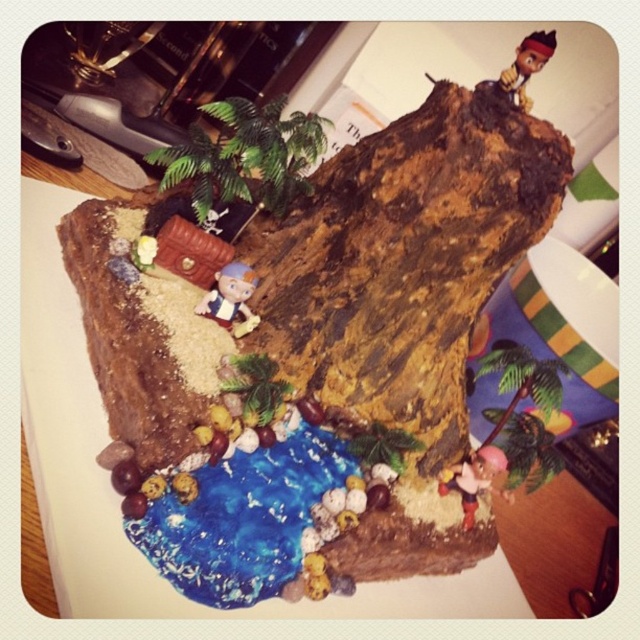
Question: Which point appears farthest from the camera in this image?

Choices:
 (A) (509, 92)
 (B) (221, 534)

Answer: (A)

Question: Among these points, which one is nearest to the camera?

Choices:
 (A) (541, 42)
 (B) (182, 557)

Answer: (B)

Question: Does brown sugar pirate ship at center have a greater width compared to smooth brown figurine at upper right?

Choices:
 (A) yes
 (B) no

Answer: (A)

Question: Does brown sugar pirate ship at center have a greater width compared to smooth brown figurine at upper right?

Choices:
 (A) no
 (B) yes

Answer: (B)

Question: Does brown sugar pirate ship at center have a lesser width compared to smooth brown figurine at upper right?

Choices:
 (A) no
 (B) yes

Answer: (A)